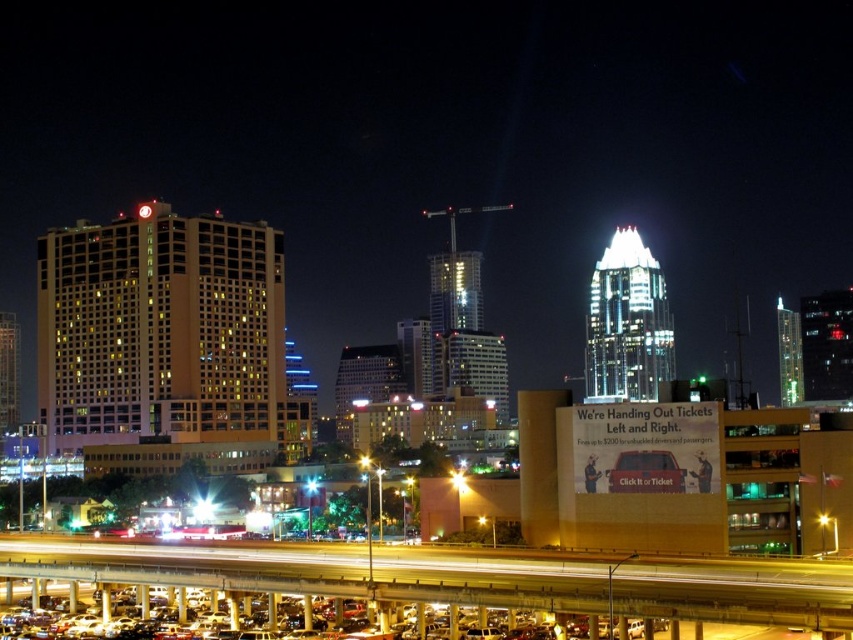
Question: In this image, where is yellow concrete highway at lower center located relative to metallic cars at lower center?

Choices:
 (A) left
 (B) right

Answer: (B)

Question: Among these points, which one is nearest to the camera?

Choices:
 (A) (547, 609)
 (B) (175, 625)

Answer: (A)

Question: Can you confirm if yellow concrete highway at lower center is thinner than metallic cars at lower center?

Choices:
 (A) no
 (B) yes

Answer: (A)

Question: Can you confirm if yellow concrete highway at lower center is positioned to the left of metallic cars at lower center?

Choices:
 (A) no
 (B) yes

Answer: (A)